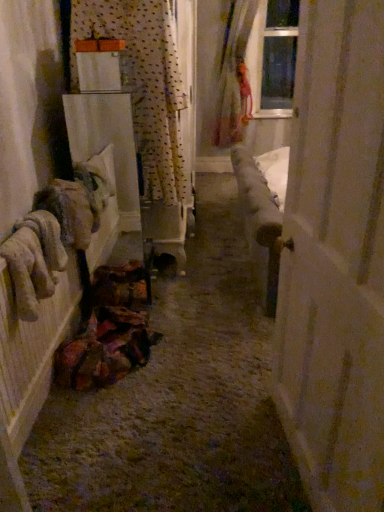
Question: Is polka dot fabric curtain at upper left, the first curtain positioned from the front, positioned with its back to white matte door at right?

Choices:
 (A) yes
 (B) no

Answer: (B)

Question: From a real-world perspective, is polka dot fabric curtain at upper left, placed as the 1th curtain when sorted from left to right, positioned under white matte door at right based on gravity?

Choices:
 (A) no
 (B) yes

Answer: (A)

Question: Is polka dot fabric curtain at upper left, the 1th curtain in the bottom-to-top sequence, not close to white matte door at right?

Choices:
 (A) yes
 (B) no

Answer: (A)

Question: Is white matte door at right located within polka dot fabric curtain at upper left, marked as the 2th curtain in a top-to-bottom arrangement?

Choices:
 (A) no
 (B) yes

Answer: (A)

Question: From a real-world perspective, does polka dot fabric curtain at upper left, marked as the 2th curtain in a top-to-bottom arrangement, stand above white matte door at right?

Choices:
 (A) no
 (B) yes

Answer: (B)

Question: Is polka dot fabric curtain at upper left, placed as the 1th curtain when sorted from left to right, at the left side of white matte door at right?

Choices:
 (A) yes
 (B) no

Answer: (A)

Question: Does translucent fabric curtain at upper right, acting as the 1th curtain starting from the right, lie behind textured fabric bag at lower left?

Choices:
 (A) yes
 (B) no

Answer: (A)

Question: From the image's perspective, is translucent fabric curtain at upper right, the 2th curtain positioned from the front, below textured fabric bag at lower left?

Choices:
 (A) yes
 (B) no

Answer: (B)

Question: Is there a large distance between translucent fabric curtain at upper right, the 2th curtain positioned from the front, and textured fabric bag at lower left?

Choices:
 (A) no
 (B) yes

Answer: (B)

Question: Is translucent fabric curtain at upper right, which appears as the first curtain when viewed from the back, outside of textured fabric bag at lower left?

Choices:
 (A) no
 (B) yes

Answer: (B)

Question: Does translucent fabric curtain at upper right, acting as the 1th curtain starting from the right, have a lesser width compared to textured fabric bag at lower left?

Choices:
 (A) no
 (B) yes

Answer: (B)

Question: Is translucent fabric curtain at upper right, the 2th curtain positioned from the front, to the left of textured fabric bag at lower left from the viewer's perspective?

Choices:
 (A) no
 (B) yes

Answer: (A)

Question: Is fuzzy beige gloves at left taller than white matte door at right?

Choices:
 (A) no
 (B) yes

Answer: (A)